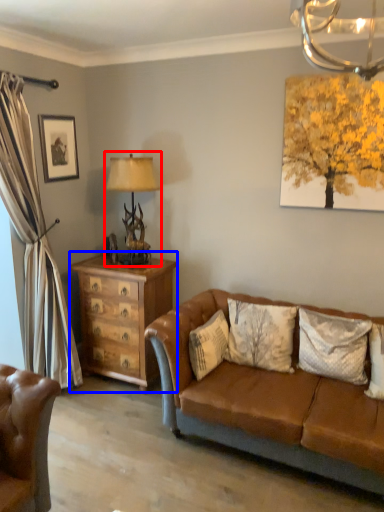
Question: Which object is closer to the camera taking this photo, table lamp (highlighted by a red box) or chest of drawers (highlighted by a blue box)?

Choices:
 (A) table lamp
 (B) chest of drawers

Answer: (A)